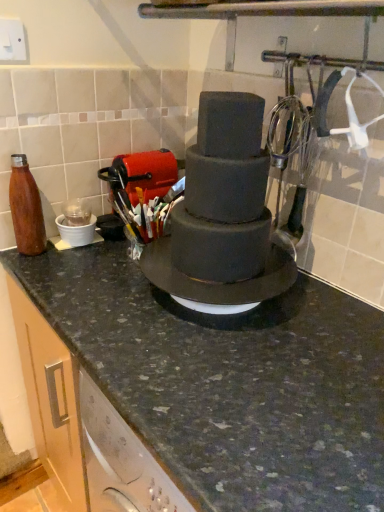
Question: Is point pos(208,173) positioned closer to the camera than point pos(28,201)?

Choices:
 (A) farther
 (B) closer

Answer: (B)

Question: In terms of height, does smooth matte chocolate cake at center look taller or shorter compared to matte brown bottle at left?

Choices:
 (A) tall
 (B) short

Answer: (A)

Question: Considering the real-world distances, which object is farthest from the matte brown bottle at left?

Choices:
 (A) smooth matte chocolate cake at center
 (B) granite countertop at center

Answer: (B)

Question: Which of these objects is positioned farthest from the smooth matte chocolate cake at center?

Choices:
 (A) granite countertop at center
 (B) matte brown bottle at left

Answer: (B)